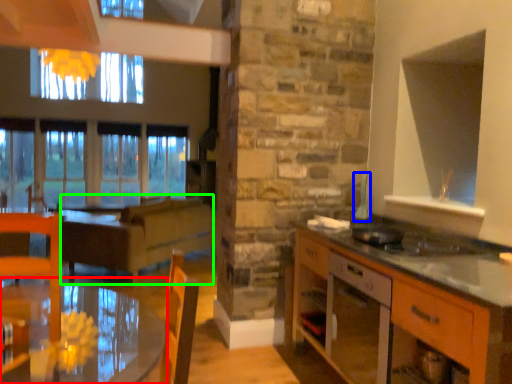
Question: Which is nearer to the table (highlighted by a red box)? appliance (highlighted by a blue box) or surround (highlighted by a green box).

Choices:
 (A) appliance
 (B) surround

Answer: (B)